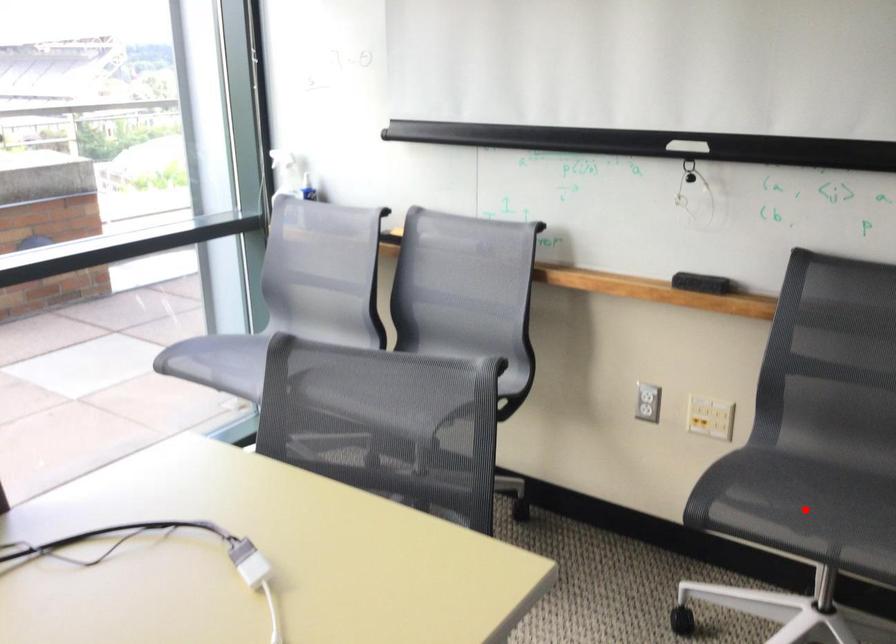
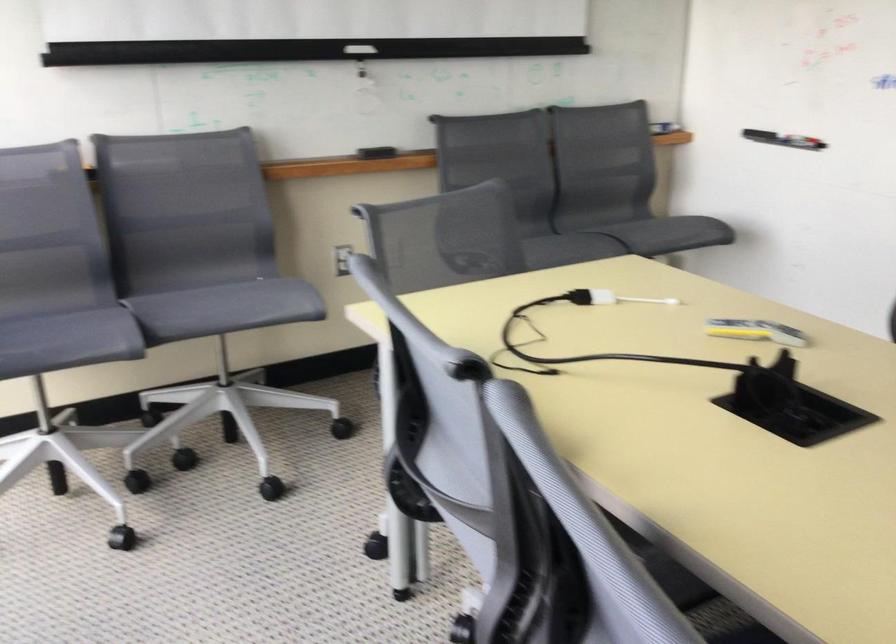
Where in the second image is the point corresponding to the highlighted location from the first image?

(538, 247)